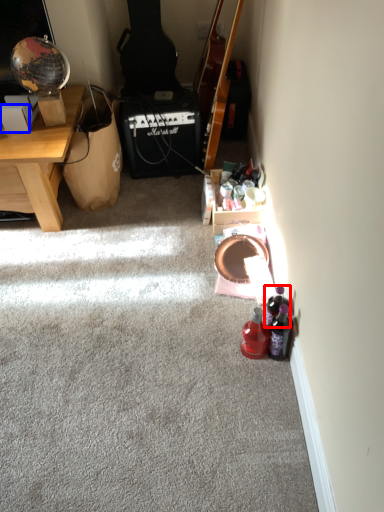
Question: Which object appears farthest to the camera in this image, bottle (highlighted by a red box) or box (highlighted by a blue box)?

Choices:
 (A) bottle
 (B) box

Answer: (B)